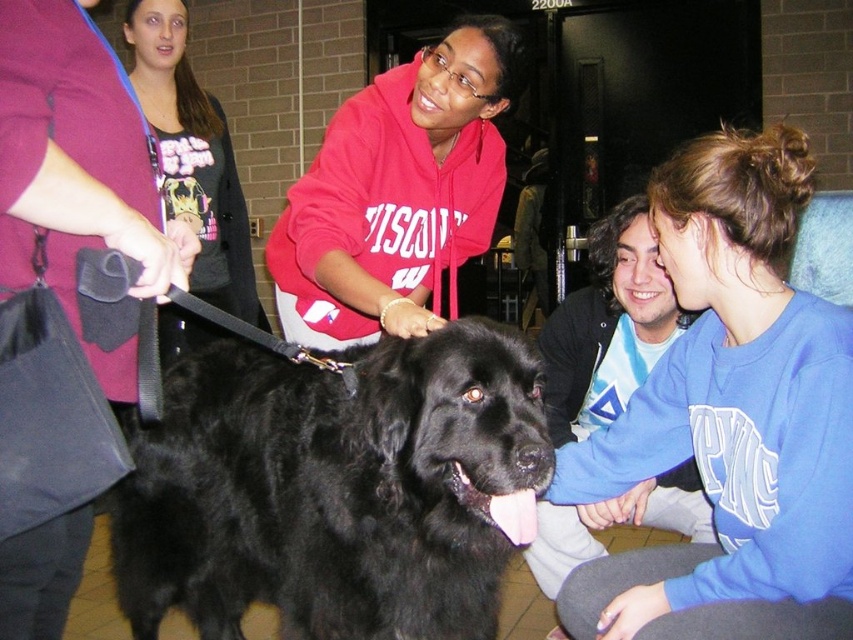
Can you confirm if blue sweatshirt at lower right is thinner than matte black leash at left?

Indeed, blue sweatshirt at lower right has a lesser width compared to matte black leash at left.

Measure the distance from blue sweatshirt at lower right to matte black leash at left.

blue sweatshirt at lower right and matte black leash at left are 5.75 feet apart.

Where is `blue sweatshirt at lower right`? Image resolution: width=853 pixels, height=640 pixels. blue sweatshirt at lower right is located at coordinates (728, 419).

Which is below, blue sweatshirt at lower right or matte black dog at center?

blue sweatshirt at lower right is below.

Between blue sweatshirt at lower right and matte black dog at center, which one is positioned higher?

matte black dog at center is higher up.

Between point (714, 561) and point (96, 176), which one is positioned behind?

Positioned behind is point (714, 561).

Locate an element on the screen. blue sweatshirt at lower right is located at coordinates (728, 419).

Between black furry dog at center and blue sweatshirt at lower right, which one is positioned higher?

blue sweatshirt at lower right is above.

Between black furry dog at center and blue sweatshirt at lower right, which one has less height?

black furry dog at center

Which is behind, point (457, 436) or point (583, 477)?

Positioned behind is point (583, 477).

The height and width of the screenshot is (640, 853). I want to click on black furry dog at center, so (335, 488).